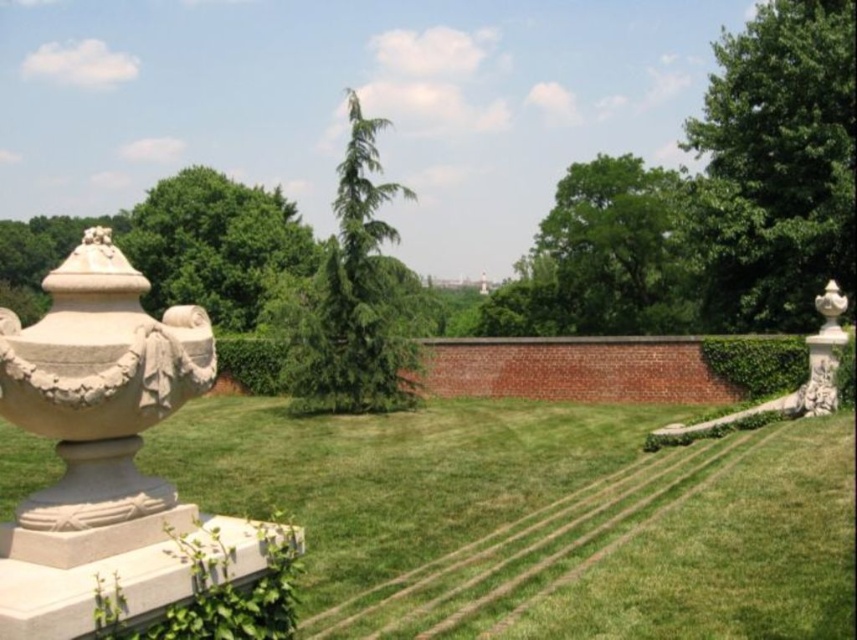
Question: Does white stone urn at left come in front of green leafy tree at upper left?

Choices:
 (A) yes
 (B) no

Answer: (A)

Question: Can you confirm if green leafy tree at upper left is thinner than white stone vase at right?

Choices:
 (A) no
 (B) yes

Answer: (A)

Question: Estimate the real-world distances between objects in this image. Which object is farther from the white stone garden at lower left?

Choices:
 (A) green leafy tree at upper left
 (B) green leafy tree at center

Answer: (A)

Question: Among these objects, which one is nearest to the camera?

Choices:
 (A) white stone vase at right
 (B) green leafy tree at upper left
 (C) white stone urn at left
 (D) green leafy tree at center

Answer: (C)

Question: Does white stone urn at left have a greater width compared to green needle-like tree at center?

Choices:
 (A) no
 (B) yes

Answer: (A)

Question: Which object is closer to the camera taking this photo?

Choices:
 (A) white stone vase at right
 (B) green leafy tree at center
 (C) green leafy tree at upper center

Answer: (A)